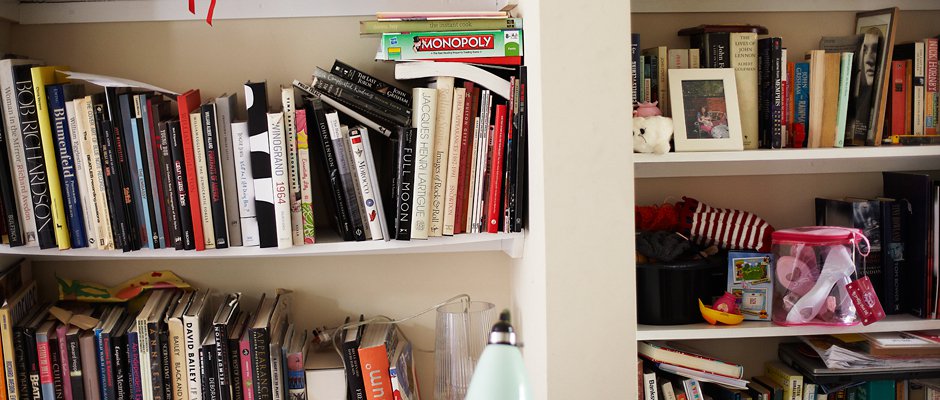
Find the location of a particular element. electrical cord is located at coordinates (371, 321).